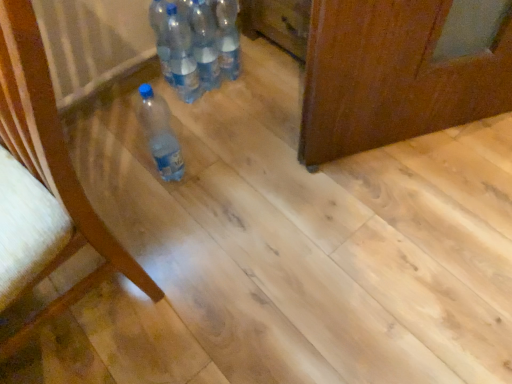
I want to click on vacant area that lies to the right of clear plastic bottle at center, the 3th bottle viewed from the top, so click(247, 99).